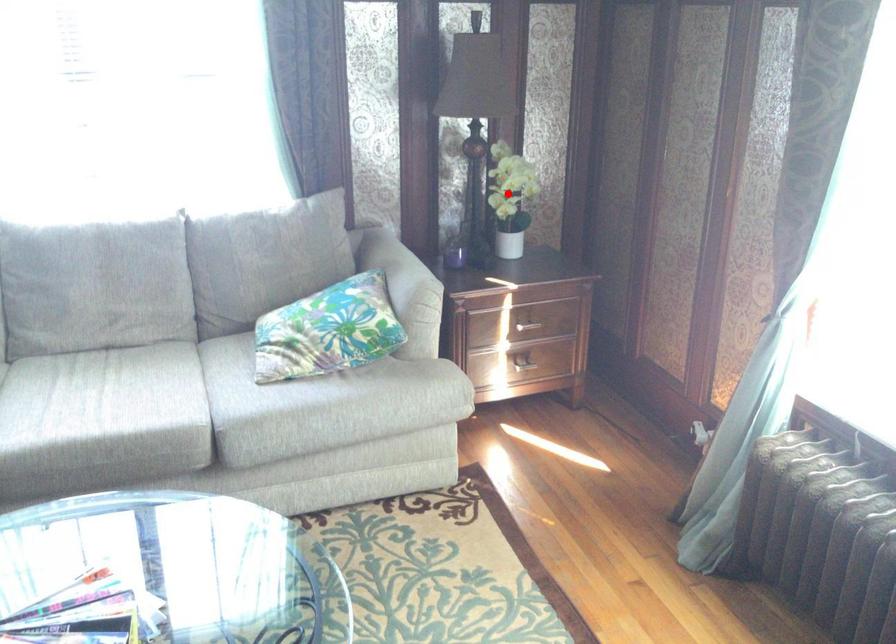
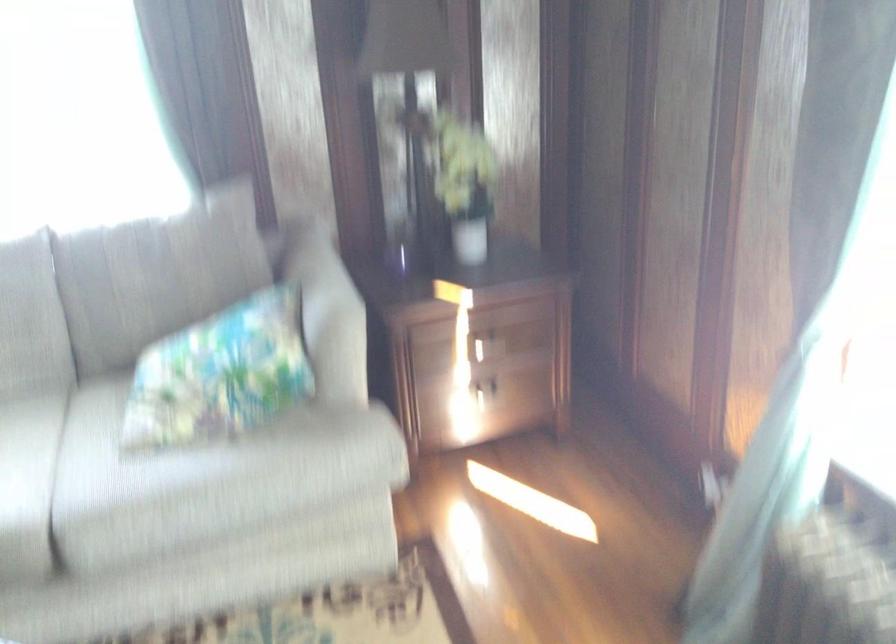
Locate, in the second image, the point that corresponds to the highlighted location in the first image.

(464, 184)